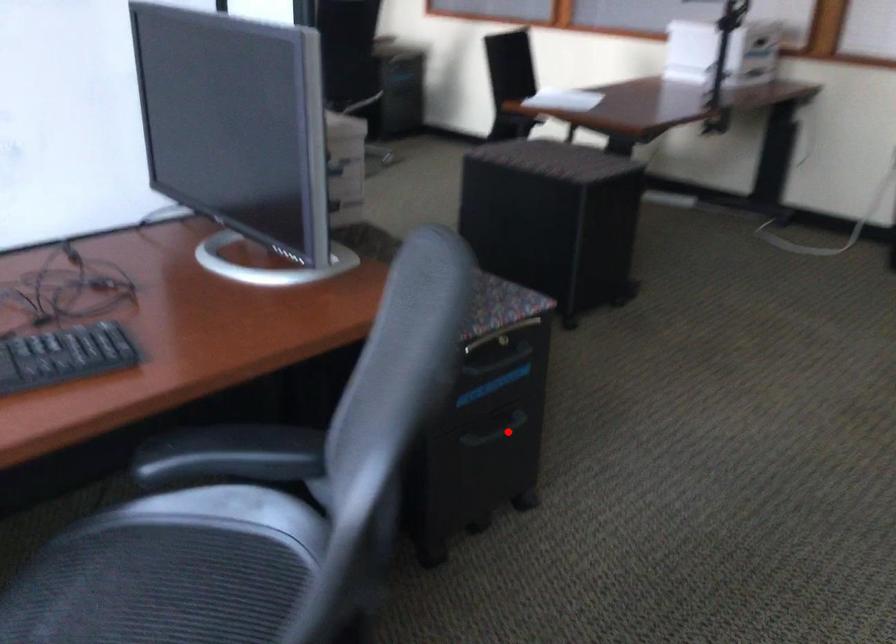
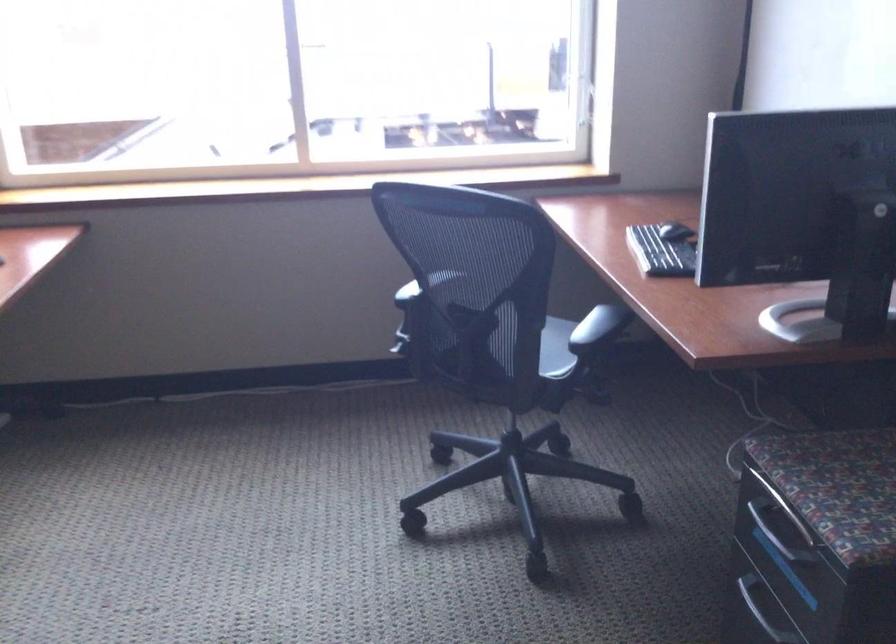
The point at the highlighted location is marked in the first image. Where is the corresponding point in the second image?

(755, 614)